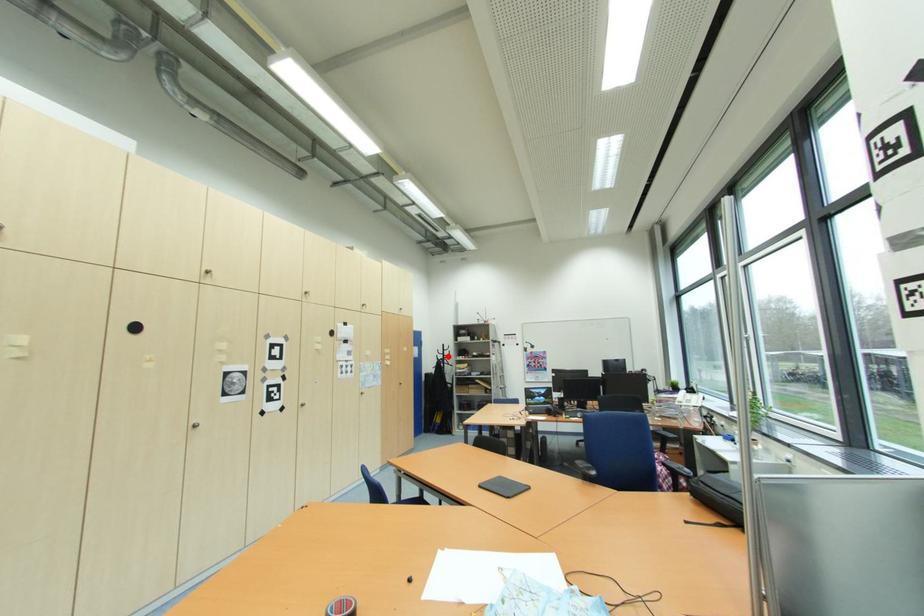
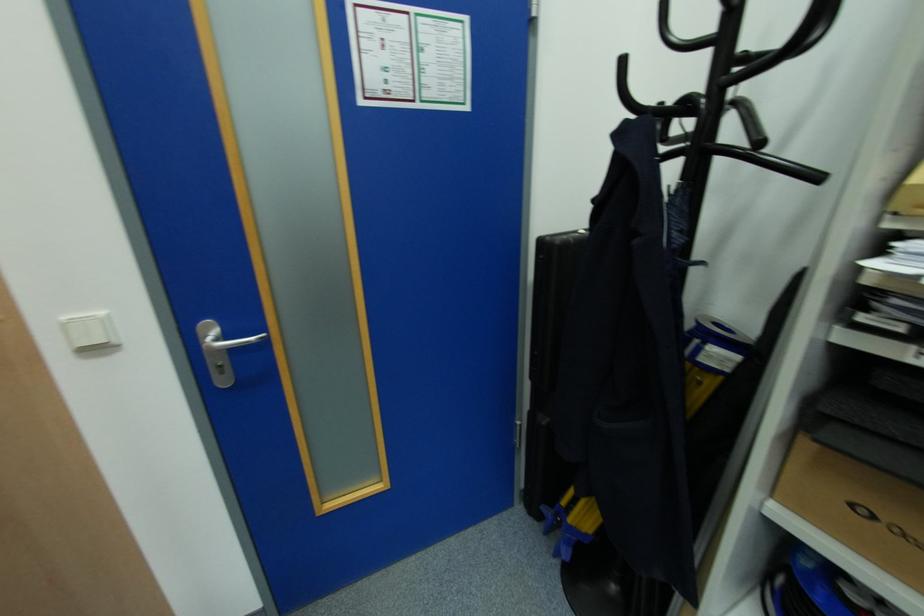
Question: I am providing you with two images of the same scene from different viewpoints. A red point is shown in image1. For the corresponding object point in image2, is it positioned nearer or farther from the camera?

Choices:
 (A) Nearer
 (B) Farther

Answer: (A)